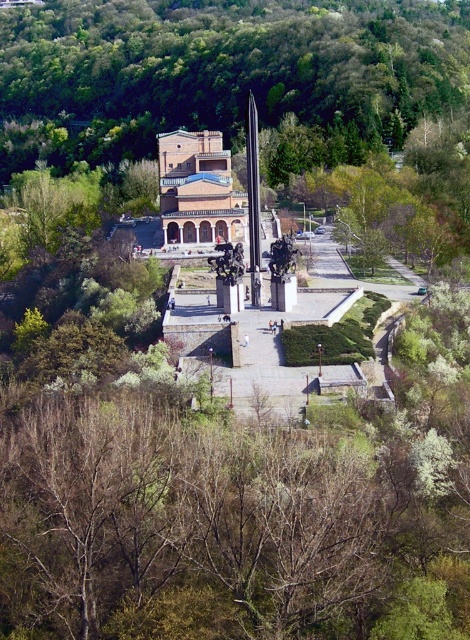
Question: From the image, what is the correct spatial relationship of green leafy trees at center in relation to brick textured church at center?

Choices:
 (A) left
 (B) right

Answer: (B)

Question: Which point is closer to the camera?

Choices:
 (A) green leafy trees at center
 (B) brick textured church at center

Answer: (B)

Question: From the image, what is the correct spatial relationship of green leafy trees at center in relation to brick textured church at center?

Choices:
 (A) left
 (B) right

Answer: (B)

Question: Can you confirm if green leafy trees at center is positioned below brick textured church at center?

Choices:
 (A) no
 (B) yes

Answer: (A)